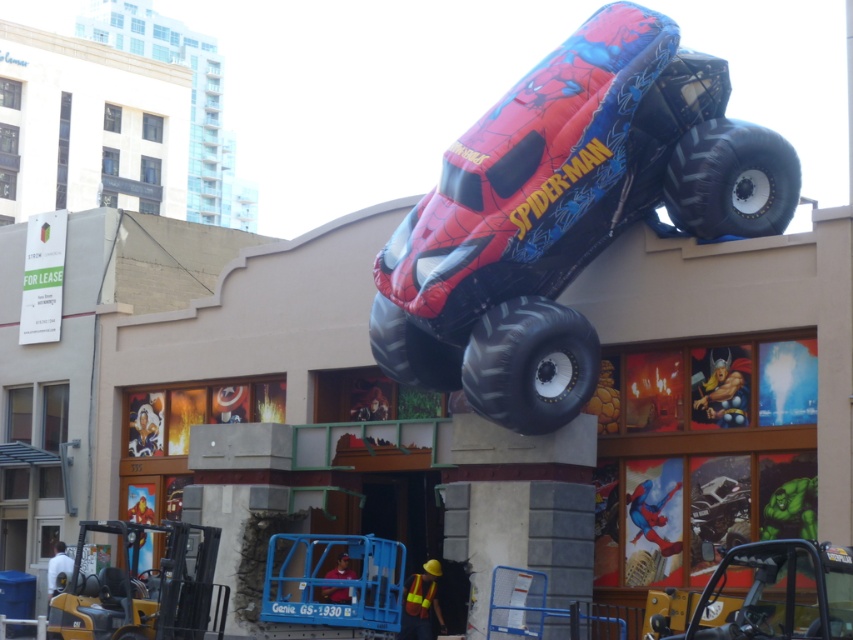
You are standing in front of the building with the inflatable Spiderman monster truck on top. There are two points marked on the building facade. The first point is at coordinate point (x=460, y=176) and the second point is at coordinate point (x=424, y=340). Which point appears closer to you?

Point (x=460, y=176) is closer to the camera than point (x=424, y=340), so the first point appears closer to you.

You are a delivery person trying to locate the Spider Man themed monster truck on top of the building. The truck is located at point (566, 212). Can you confirm if this point is at the upper center of the building?

Yes, the point (566, 212) indicates the matte plastic spider man monster truck is at the upper center of the building.